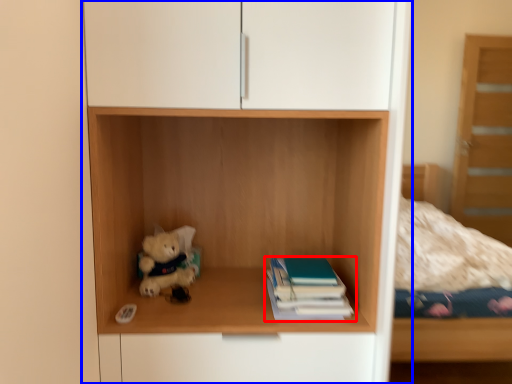
Question: Which object is further to the camera taking this photo, book (highlighted by a red box) or cupboard (highlighted by a blue box)?

Choices:
 (A) book
 (B) cupboard

Answer: (A)